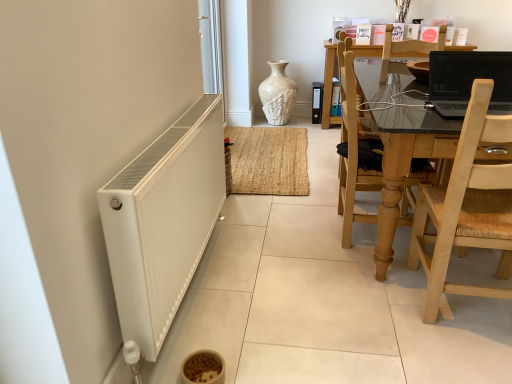
The image size is (512, 384). Describe the element at coordinates (469, 81) in the screenshot. I see `black glossy laptop at upper right` at that location.

The height and width of the screenshot is (384, 512). In order to click on black glossy laptop at upper right in this screenshot , I will do `click(469, 81)`.

The width and height of the screenshot is (512, 384). What do you see at coordinates (163, 221) in the screenshot?
I see `white matte radiator at lower left` at bounding box center [163, 221].

What is the approximate width of white textured vase at center?

→ The width of white textured vase at center is 14.22 inches.

In order to face white textured file cabinet at center, should I rotate leftwards or rightwards?

Turn right by 8.310 degrees to look at white textured file cabinet at center.

The image size is (512, 384). Describe the element at coordinates (317, 102) in the screenshot. I see `white textured file cabinet at center` at that location.

The image size is (512, 384). What do you see at coordinates (353, 147) in the screenshot?
I see `wooden chair at right, positioned as the first chair in back-to-front order` at bounding box center [353, 147].

Identify the location of black glossy laptop at upper right. This screenshot has height=384, width=512. (469, 81).

Can you confirm if white textured file cabinet at center is bigger than white glossy screen door at upper left?

Incorrect, white textured file cabinet at center is not larger than white glossy screen door at upper left.

Is white textured file cabinet at center wider or thinner than white glossy screen door at upper left?

white textured file cabinet at center is wider than white glossy screen door at upper left.

Is point (319, 122) more distant than point (213, 26)?

Yes, it is.

Based on their positions, is white textured file cabinet at center located to the left or right of light wood woven seat at right, the second chair in the back-to-front sequence?

white textured file cabinet at center is to the left of light wood woven seat at right, the second chair in the back-to-front sequence.

From the image's perspective, which is above, white textured file cabinet at center or light wood woven seat at right, which appears as the first chair when viewed from the front?

white textured file cabinet at center is shown above in the image.

Is white textured file cabinet at center far from light wood woven seat at right, the second chair in the back-to-front sequence?

Yes, white textured file cabinet at center and light wood woven seat at right, the second chair in the back-to-front sequence, are located far from each other.

Is black glossy laptop at upper right completely or partially outside of white matte radiator at lower left?

Indeed, black glossy laptop at upper right is completely outside white matte radiator at lower left.

Can you see black glossy laptop at upper right touching white matte radiator at lower left?

No, black glossy laptop at upper right is not in contact with white matte radiator at lower left.

Considering their positions, is black glossy laptop at upper right located in front of or behind white matte radiator at lower left?

Visually, black glossy laptop at upper right is located behind white matte radiator at lower left.

Does wooden chair at right, which is the second chair in front-to-back order, have a lesser height compared to black glossy laptop at upper right?

Incorrect, the height of wooden chair at right, which is the second chair in front-to-back order, does not fall short of that of black glossy laptop at upper right.

What's the angular difference between wooden chair at right, which is the second chair in front-to-back order, and black glossy laptop at upper right's facing directions?

The facing directions of wooden chair at right, which is the second chair in front-to-back order, and black glossy laptop at upper right are 89.9 degrees apart.

Looking at this image, visually, is wooden chair at right, positioned as the first chair in back-to-front order, positioned to the left or to the right of black glossy laptop at upper right?

wooden chair at right, positioned as the first chair in back-to-front order, is positioned on black glossy laptop at upper right's left side.

Which of these two, wooden chair at right, positioned as the first chair in back-to-front order, or black glossy laptop at upper right, is smaller?

With smaller size is black glossy laptop at upper right.

Is point (466, 205) behind point (505, 97)?

No, (466, 205) is in front of (505, 97).

How much distance is there between light wood woven seat at right, the second chair in the back-to-front sequence, and black glossy laptop at upper right?

The distance of light wood woven seat at right, the second chair in the back-to-front sequence, from black glossy laptop at upper right is 19.74 inches.

The height and width of the screenshot is (384, 512). Find the location of `laptop behind the light wood woven seat at right, the second chair in the back-to-front sequence`. laptop behind the light wood woven seat at right, the second chair in the back-to-front sequence is located at coordinates (469, 81).

From a real-world perspective, is light wood woven seat at right, the second chair in the back-to-front sequence, positioned over black glossy laptop at upper right based on gravity?

No.

Is wooden chair at right, positioned as the first chair in back-to-front order, looking in the opposite direction of white textured file cabinet at center?

No, white textured file cabinet at center is not at the back of wooden chair at right, positioned as the first chair in back-to-front order.

From the image's perspective, is wooden chair at right, positioned as the first chair in back-to-front order, located beneath white textured file cabinet at center?

Correct, wooden chair at right, positioned as the first chair in back-to-front order, appears lower than white textured file cabinet at center in the image.

Which object is further away from the camera, wooden chair at right, which is the second chair in front-to-back order, or white textured file cabinet at center?

white textured file cabinet at center is further from the camera.

Looking at this image, is wooden chair at right, positioned as the first chair in back-to-front order, with white textured file cabinet at center?

No, wooden chair at right, positioned as the first chair in back-to-front order, is not next to white textured file cabinet at center.

How many degrees apart are the facing directions of white textured vase at center and white textured file cabinet at center?

0.225 degrees separate the facing orientations of white textured vase at center and white textured file cabinet at center.

Considering the sizes of objects white textured vase at center and white textured file cabinet at center in the image provided, who is thinner, white textured vase at center or white textured file cabinet at center?

white textured file cabinet at center.

The height and width of the screenshot is (384, 512). I want to click on vase above the white textured file cabinet at center (from the image's perspective), so click(277, 94).

Is white textured file cabinet at center at the back of white textured vase at center?

white textured vase at center is not turned away from white textured file cabinet at center.

Identify the location of appliance below the white glossy screen door at upper left (from the image's perspective). (317, 102).

At what (x,y) coordinates should I click in order to perform the action: click on appliance that appears above the light wood woven seat at right, the second chair in the back-to-front sequence (from the image's perspective). Please return your answer as a coordinate pair (x, y). Looking at the image, I should click on (317, 102).

Which object lies further to the anchor point white textured file cabinet at center, white textured vase at center or white glossy screen door at upper left?

Among the two, white glossy screen door at upper left is located further to white textured file cabinet at center.

Based on their spatial positions, is wooden chair at right, positioned as the first chair in back-to-front order, or white textured vase at center further from white textured file cabinet at center?

The object further to white textured file cabinet at center is wooden chair at right, positioned as the first chair in back-to-front order.

Which object lies further to the anchor point white textured file cabinet at center, white matte radiator at lower left or white glossy screen door at upper left?

white matte radiator at lower left lies further to white textured file cabinet at center than the other object.

Considering their positions, is white matte radiator at lower left positioned further to white glossy screen door at upper left than white textured vase at center?

Among the two, white matte radiator at lower left is located further to white glossy screen door at upper left.

Looking at the image, which one is located further to wooden chair at right, which is the second chair in front-to-back order, black glossy laptop at upper right or light wood woven seat at right, which appears as the first chair when viewed from the front?

The object further to wooden chair at right, which is the second chair in front-to-back order, is light wood woven seat at right, which appears as the first chair when viewed from the front.

In the scene shown: When comparing their distances from wooden chair at right, which is the second chair in front-to-back order, does white matte radiator at lower left or light wood woven seat at right, the second chair in the back-to-front sequence, seem closer?

light wood woven seat at right, the second chair in the back-to-front sequence, is closer to wooden chair at right, which is the second chair in front-to-back order.

Which object lies nearer to the anchor point wooden chair at right, positioned as the first chair in back-to-front order, white textured vase at center or white textured file cabinet at center?

The object closer to wooden chair at right, positioned as the first chair in back-to-front order, is white textured vase at center.

Based on their spatial positions, is white matte radiator at lower left or black glossy laptop at upper right further from white glossy screen door at upper left?

Based on the image, black glossy laptop at upper right appears to be further to white glossy screen door at upper left.

Where is `chair between light wood woven seat at right, which appears as the first chair when viewed from the front, and white glossy screen door at upper left, along the z-axis`? Image resolution: width=512 pixels, height=384 pixels. chair between light wood woven seat at right, which appears as the first chair when viewed from the front, and white glossy screen door at upper left, along the z-axis is located at coordinates (353, 147).

Identify the location of vase located between light wood woven seat at right, the second chair in the back-to-front sequence, and white textured file cabinet at center in the depth direction. The width and height of the screenshot is (512, 384). (277, 94).

Find the location of a particular element. The width and height of the screenshot is (512, 384). screen door between wooden chair at right, which is the second chair in front-to-back order, and white textured file cabinet at center, along the z-axis is located at coordinates (211, 45).

I want to click on vase between white glossy screen door at upper left and white textured file cabinet at center along the z-axis, so click(277, 94).